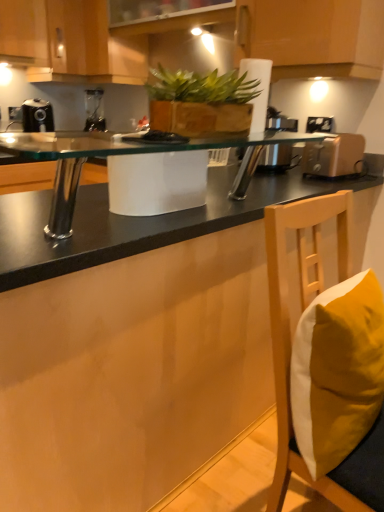
Question: In terms of width, does black plastic coffee machine at left look wider or thinner when compared to matte wood cabinet at upper left, the 1th cabinetry from the left?

Choices:
 (A) wide
 (B) thin

Answer: (B)

Question: Based on their positions, is black plastic coffee machine at left located to the left or right of matte wood cabinet at upper left, the 1th cabinetry from the left?

Choices:
 (A) left
 (B) right

Answer: (B)

Question: Which is nearer to the black plastic coffee machine at left?

Choices:
 (A) wooden cabinet at upper center, acting as the third cabinetry starting from the left
 (B) wooden cabinet at upper center, which appears as the second cabinetry when viewed from the left
 (C) white plastic electric outlet at upper right
 (D) metallic silver toaster at right
 (E) green leafy plant at center

Answer: (B)

Question: Based on their relative distances, which object is nearer to the wooden cabinet at upper center, acting as the third cabinetry starting from the left?

Choices:
 (A) black glass countertop at center
 (B) black plastic coffee machine at left
 (C) metallic silver toaster at right
 (D) wooden cabinet at upper center, positioned as the second cabinetry in right-to-left order
 (E) green leafy plant at center

Answer: (C)